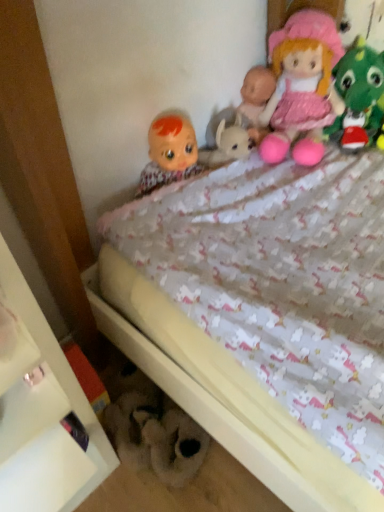
The image size is (384, 512). In order to click on empty space that is ontop of white glossy shelf at lower left (from a real-world perspective) in this screenshot , I will do `click(39, 466)`.